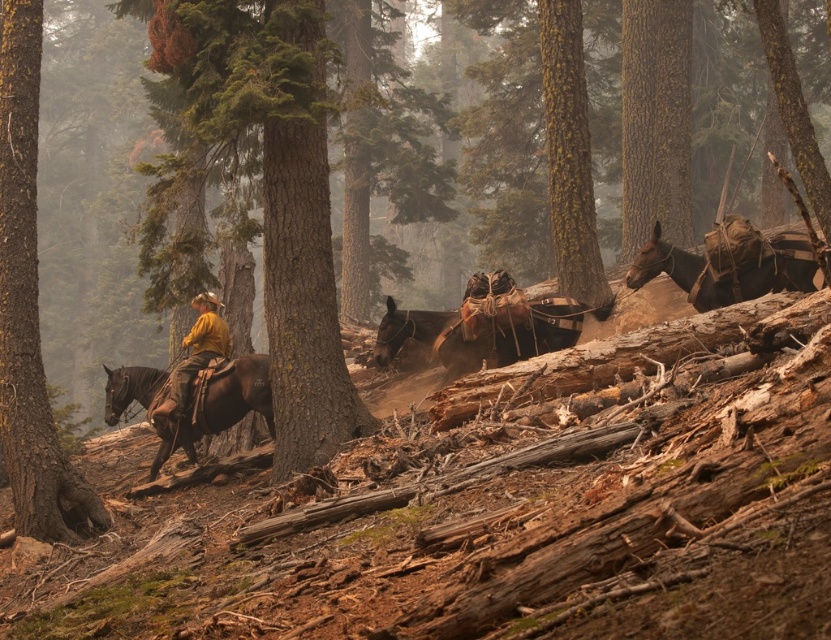
You are a hiker trying to determine which object is narrower between the smooth bark tree at center and the brown leather horse at right. Based on the scene, which one is thinner?

The smooth bark tree at center is thinner than the brown leather horse at right according to the description.